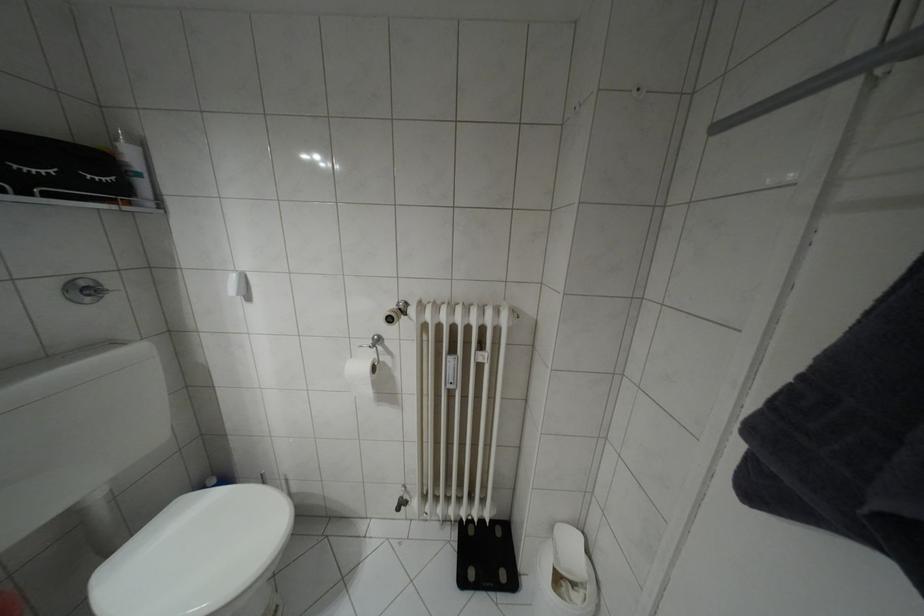
Where would you press the toilet flush button? Please return your answer as a coordinate pair (x, y).

(100, 284)